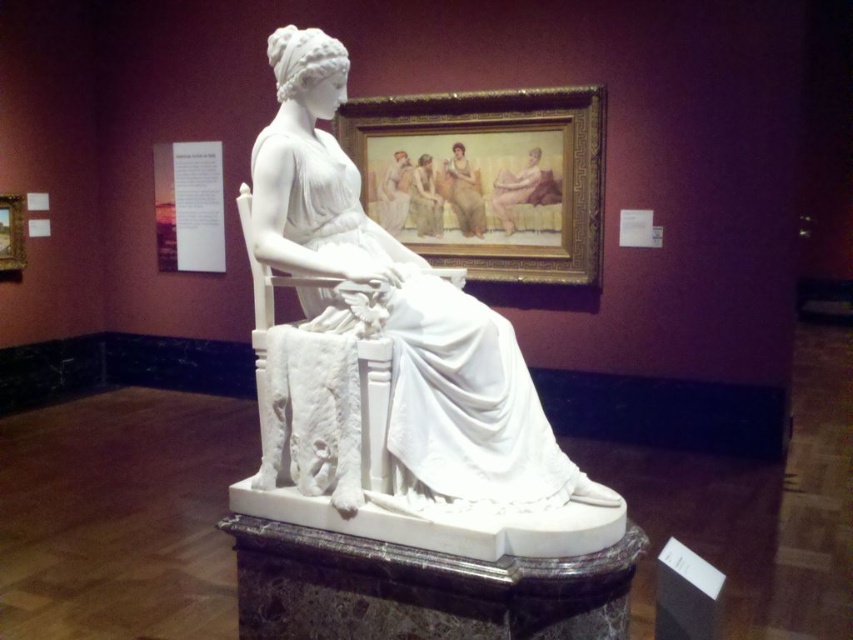
You are a visitor in the museum and want to take a photo of the smooth beige fabric at upper center and the smooth beige skin at upper center. Which one will appear closer to you in the photo?

The smooth beige fabric at upper center will appear closer to you in the photo because it is positioned further to the viewer than the smooth beige skin at upper center.

You are a visitor in the museum and want to take a photo of both the white marble dress at center and the matte white figure at center. Which one should you zoom in more on to ensure it fits properly in the frame?

Since the white marble dress at center is larger in size than the matte white figure at center, you should zoom in more on the matte white figure at center to ensure it fits properly in the frame.